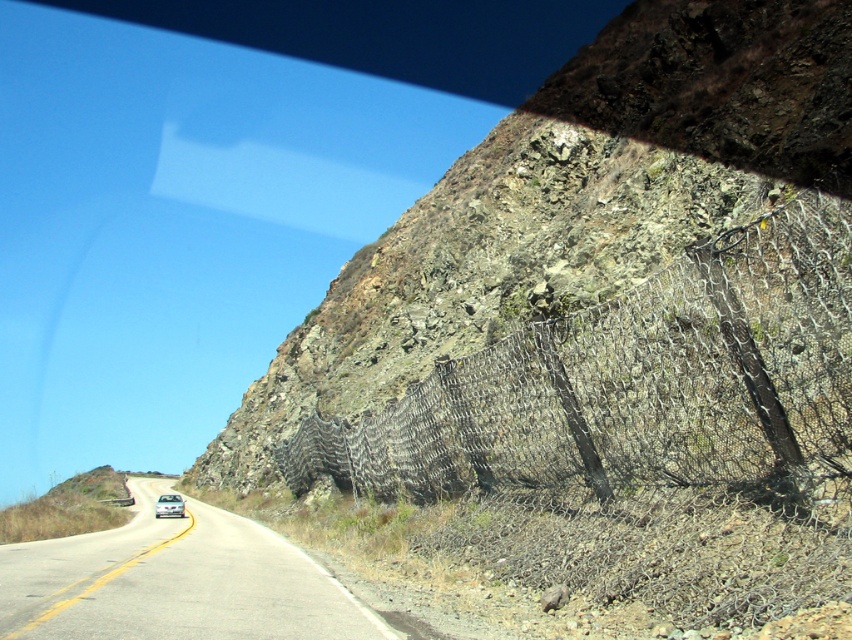
Question: Which point appears closest to the camera in this image?

Choices:
 (A) (211, 595)
 (B) (816, 513)
 (C) (660, 180)
 (D) (180, 512)

Answer: (B)

Question: Is rusty wire mesh fence at upper right behind white glossy car at center?

Choices:
 (A) yes
 (B) no

Answer: (B)

Question: From the image, what is the correct spatial relationship of rusty wire mesh fence at upper right in relation to white glossy car at center?

Choices:
 (A) above
 (B) below

Answer: (A)

Question: Among these objects, which one is farthest from the camera?

Choices:
 (A) rugged stone mountain at center
 (B) white asphalt road at center
 (C) rusty wire mesh fence at upper right

Answer: (A)

Question: Which point is farther to the camera?

Choices:
 (A) (403, 380)
 (B) (157, 515)

Answer: (B)

Question: Can you confirm if rugged stone mountain at center is positioned below white glossy car at center?

Choices:
 (A) yes
 (B) no

Answer: (B)